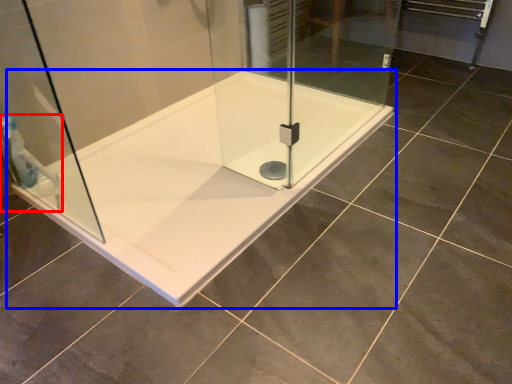
Question: Which of the following is the closest to the observer, shower (highlighted by a red box) or bathtub (highlighted by a blue box)?

Choices:
 (A) shower
 (B) bathtub

Answer: (B)